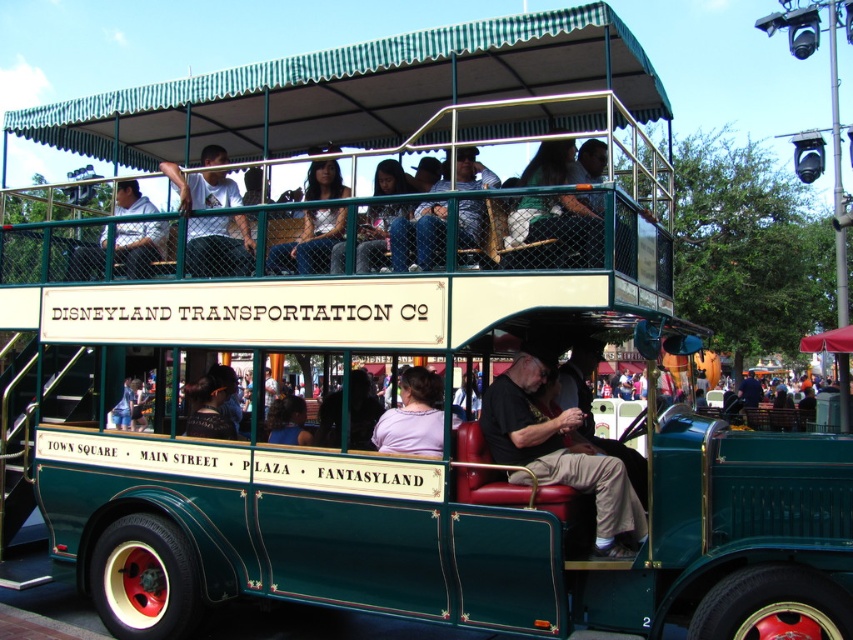
Question: Can you confirm if leather seat at center is bigger than matte silver jacket at center?

Choices:
 (A) no
 (B) yes

Answer: (B)

Question: Which object is closer to the camera taking this photo?

Choices:
 (A) leather seat at center
 (B) matte silver jacket at center

Answer: (A)

Question: Which point is farther to the camera?

Choices:
 (A) matte silver jacket at center
 (B) leather seat at center

Answer: (A)

Question: Can you confirm if leather seat at center is wider than matte silver jacket at center?

Choices:
 (A) no
 (B) yes

Answer: (B)

Question: Is leather seat at center positioned before matte silver jacket at center?

Choices:
 (A) yes
 (B) no

Answer: (A)

Question: Which object appears closest to the camera in this image?

Choices:
 (A) leather seat at center
 (B) matte silver jacket at center

Answer: (A)